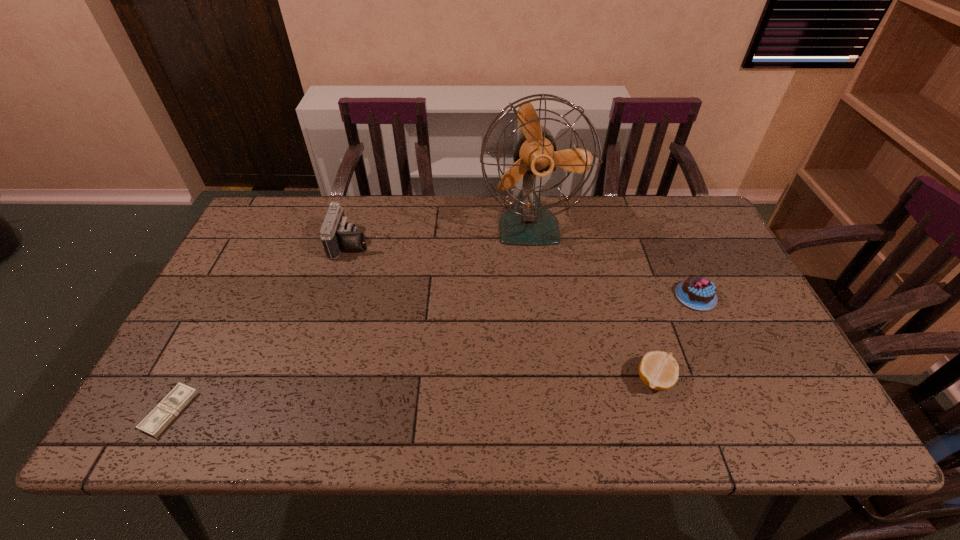
At what (x,y) coordinates should I click in order to perform the action: click on vacant space positioned on the front-facing side of the tallest object for air flow. Please return your answer as a coordinate pair (x, y). Looking at the image, I should click on (537, 282).

Where is `vacant region located 0.080m at the front of the second object from left to right with an open lens cover`? vacant region located 0.080m at the front of the second object from left to right with an open lens cover is located at coordinates (396, 242).

At what (x,y) coordinates should I click in order to perform the action: click on vacant space situated 0.250m on the left of the rightmost object. Please return your answer as a coordinate pair (x, y). Looking at the image, I should click on (584, 296).

The width and height of the screenshot is (960, 540). I want to click on vacant position located 0.050m on the front of the fourth tallest object, so (x=667, y=420).

I want to click on free space located on the back of the money, so click(x=222, y=312).

You are a GUI agent. You are given a task and a screenshot of the screen. Output one action in this format:
    pyautogui.click(x=<x>, y=<y>)
    Task: Click on the fan that is positioned at the far edge
    The width and height of the screenshot is (960, 540).
    Given the screenshot: What is the action you would take?
    pyautogui.click(x=526, y=222)

The width and height of the screenshot is (960, 540). I want to click on camera that is at the far edge, so click(x=337, y=234).

The height and width of the screenshot is (540, 960). In order to click on object situated at the near edge in this screenshot , I will do `click(162, 415)`.

You are a GUI agent. You are given a task and a screenshot of the screen. Output one action in this format:
    pyautogui.click(x=<x>, y=<y>)
    Task: Click on the object positioned at the left edge
    The image size is (960, 540).
    Given the screenshot: What is the action you would take?
    pyautogui.click(x=162, y=415)

This screenshot has width=960, height=540. I want to click on object located at the right edge, so tap(699, 293).